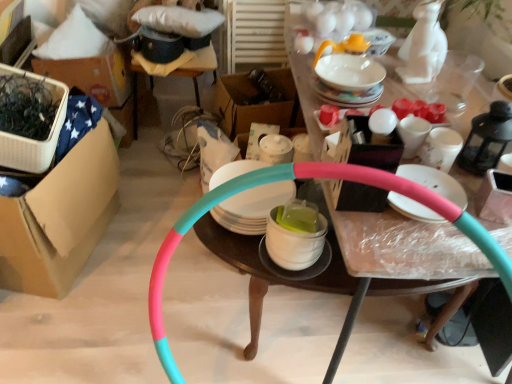
Where is `porcelain bowl at upper center, which is the 2th tableware from top to bottom`? The image size is (512, 384). porcelain bowl at upper center, which is the 2th tableware from top to bottom is located at coordinates (349, 72).

In order to face white glossy mug at upper right, which appears as the sixth tableware when ordered from the bottom, should I rotate leftwards or rightwards?

Rotate your view right by about 20.893°.

The width and height of the screenshot is (512, 384). What do you see at coordinates (435, 182) in the screenshot?
I see `matte white plate at center, which ranks as the third tableware in bottom-to-top order` at bounding box center [435, 182].

The height and width of the screenshot is (384, 512). Describe the element at coordinates (198, 68) in the screenshot. I see `wooden stool at upper left, arranged as the 1th table when viewed from the back` at that location.

This screenshot has width=512, height=384. What are the coordinates of `porcelain bowl at upper center, which is the 2th tableware from top to bottom` in the screenshot? It's located at (349, 72).

From the image's perspective, is wooden stool at upper left, arranged as the 1th table when viewed from the back, positioned above or below white glossy mug at upper right, which appears as the sixth tableware when ordered from the bottom?

Clearly, from the image's perspective, wooden stool at upper left, arranged as the 1th table when viewed from the back, is above white glossy mug at upper right, which appears as the sixth tableware when ordered from the bottom.

Between wooden stool at upper left, which is counted as the first table, starting from the top, and white glossy mug at upper right, placed as the third tableware when sorted from top to bottom, which one has larger size?

With larger size is wooden stool at upper left, which is counted as the first table, starting from the top.

Locate an element on the screen. The height and width of the screenshot is (384, 512). the 1st table located beneath the white glossy mug at upper right, which appears as the sixth tableware when ordered from the bottom (from a real-world perspective) is located at coordinates (198, 68).

From their relative heights in the image, would you say wooden stool at upper left, the 2th table positioned from the right, is taller or shorter than white glossy mug at upper right, placed as the third tableware when sorted from top to bottom?

In the image, wooden stool at upper left, the 2th table positioned from the right, appears to be taller than white glossy mug at upper right, placed as the third tableware when sorted from top to bottom.

How different are the orientations of porcelain teapot at upper right, which ranks as the 8th tableware in bottom-to-top order, and brown cardboard box at left in degrees?

porcelain teapot at upper right, which ranks as the 8th tableware in bottom-to-top order, and brown cardboard box at left are facing 105 degrees away from each other.

From the picture: Is porcelain teapot at upper right, which ranks as the 8th tableware in bottom-to-top order, positioned far away from brown cardboard box at left?

Absolutely, porcelain teapot at upper right, which ranks as the 8th tableware in bottom-to-top order, is distant from brown cardboard box at left.

Locate an element on the screen. The image size is (512, 384). tableware that is the 5th one when counting upward from the brown cardboard box at left (from the image's perspective) is located at coordinates (344, 46).

Considering the sizes of porcelain teapot at upper right, the first tableware viewed from the top, and brown cardboard box at left in the image, is porcelain teapot at upper right, the first tableware viewed from the top, taller or shorter than brown cardboard box at left?

In the image, porcelain teapot at upper right, the first tableware viewed from the top, appears to be shorter than brown cardboard box at left.

Which of these two, brown cardboard box at left or matte white plate at center, arranged as the sixth tableware when viewed from the top, stands shorter?

matte white plate at center, arranged as the sixth tableware when viewed from the top.

From a real-world perspective, which object stands above the other?

In real-world perspective, matte white plate at center, which ranks as the third tableware in bottom-to-top order, is above.

Considering the positions of point (89, 221) and point (435, 178), is point (89, 221) closer or farther from the camera than point (435, 178)?

Point (89, 221) appears to be farther away from the viewer than point (435, 178).

Looking at this image, can you confirm if wooden stool at upper left, positioned as the second table in bottom-to-top order, is thinner than matte white plate at center, arranged as the sixth tableware when viewed from the top?

No.

From a real-world perspective, is wooden stool at upper left, acting as the 2th table starting from the front, located higher than matte white plate at center, which ranks as the third tableware in bottom-to-top order?

No, from a real-world perspective, wooden stool at upper left, acting as the 2th table starting from the front, is not on top of matte white plate at center, which ranks as the third tableware in bottom-to-top order.

Considering the positions of objects wooden stool at upper left, which is counted as the first table, starting from the top, and matte white plate at center, arranged as the sixth tableware when viewed from the top, in the image provided, who is more to the left, wooden stool at upper left, which is counted as the first table, starting from the top, or matte white plate at center, arranged as the sixth tableware when viewed from the top,?

From the viewer's perspective, wooden stool at upper left, which is counted as the first table, starting from the top, appears more on the left side.

Is point (273, 243) farther from camera compared to point (307, 176)?

Yes.

Based on the photo, considering the relative positions of white glossy bowl at center, the 8th tableware viewed from the top, and teal-pink plastic hoop at center, which ranks as the second table in back-to-front order, in the image provided, is white glossy bowl at center, the 8th tableware viewed from the top, to the left of teal-pink plastic hoop at center, which ranks as the second table in back-to-front order, from the viewer's perspective?

Yes.

Between white glossy bowl at center, acting as the first tableware starting from the bottom, and teal-pink plastic hoop at center, which is the 1th table from bottom to top, which one has more height?

Standing taller between the two is teal-pink plastic hoop at center, which is the 1th table from bottom to top.

Are white glossy bowl at center, acting as the first tableware starting from the bottom, and teal-pink plastic hoop at center, which ranks as the second table in back-to-front order, beside each other?

No, white glossy bowl at center, acting as the first tableware starting from the bottom, is not next to teal-pink plastic hoop at center, which ranks as the second table in back-to-front order.

Between porcelain teapot at upper right, which ranks as the 8th tableware in bottom-to-top order, and teal-pink plastic hoop at center, which is the 1th table in right-to-left order, which one appears on the right side from the viewer's perspective?

teal-pink plastic hoop at center, which is the 1th table in right-to-left order.

Which is more distant, (321, 47) or (194, 222)?

The point (321, 47) is farther.

In the scene shown: Can you confirm if white glossy mug at upper right, which appears as the sixth tableware when ordered from the bottom, is positioned to the right of wooden stool at upper left, the 2th table positioned from the right?

Correct, you'll find white glossy mug at upper right, which appears as the sixth tableware when ordered from the bottom, to the right of wooden stool at upper left, the 2th table positioned from the right.

Which is farther, (421, 143) or (189, 60)?

The point (189, 60) is farther.

Is white glossy mug at upper right, placed as the third tableware when sorted from top to bottom, directly adjacent to wooden stool at upper left, which is the first table in left-to-right order?

No, white glossy mug at upper right, placed as the third tableware when sorted from top to bottom, is not next to wooden stool at upper left, which is the first table in left-to-right order.

From the image's perspective, is white glossy mug at upper right, placed as the third tableware when sorted from top to bottom, on wooden stool at upper left, the 2th table positioned from the right?

No.

The width and height of the screenshot is (512, 384). What are the coordinates of `table that appears behind the white glossy mug at upper right, which appears as the sixth tableware when ordered from the bottom` in the screenshot? It's located at (198, 68).

Locate an element on the screen. cardboard box below the porcelain teapot at upper right, the first tableware viewed from the top (from the image's perspective) is located at coordinates (60, 218).

Looking at this image, when comparing their distances from matte white plate at center, arranged as the sixth tableware when viewed from the top, does porcelain teapot at upper right, which ranks as the 8th tableware in bottom-to-top order, or brown cardboard box at left seem further?

brown cardboard box at left lies further to matte white plate at center, arranged as the sixth tableware when viewed from the top, than the other object.

Looking at the image, which one is located closer to matte white plate at center, arranged as the sixth tableware when viewed from the top, white glossy mug at center, which appears as the 4th tableware when viewed from the top, or porcelain bowl at upper center, which is the 2th tableware from top to bottom?

Among the two, white glossy mug at center, which appears as the 4th tableware when viewed from the top, is located nearer to matte white plate at center, arranged as the sixth tableware when viewed from the top.

Estimate the real-world distances between objects in this image. Which object is closer to white glossy mug at upper right, arranged as the 4th tableware when ordered from the bottom, white glossy plate at center, the 7th tableware when ordered from top to bottom, or white glossy bowl at center, acting as the first tableware starting from the bottom?

white glossy bowl at center, acting as the first tableware starting from the bottom, is positioned closer to the anchor white glossy mug at upper right, arranged as the 4th tableware when ordered from the bottom.

Estimate the real-world distances between objects in this image. Which object is further from porcelain teapot at upper right, the first tableware viewed from the top, teal-pink plastic hoop at center, which is the 1th table in right-to-left order, or matte white plate at center, which ranks as the third tableware in bottom-to-top order?

teal-pink plastic hoop at center, which is the 1th table in right-to-left order, lies further to porcelain teapot at upper right, the first tableware viewed from the top, than the other object.

Considering their positions, is porcelain teapot at upper right, the first tableware viewed from the top, positioned further to brown cardboard box at left than white glossy bowl at center, acting as the first tableware starting from the bottom?

porcelain teapot at upper right, the first tableware viewed from the top, is further to brown cardboard box at left.

Considering their positions, is porcelain bowl at upper center, which is the 2th tableware from top to bottom, positioned further to white glossy plate at center, the 7th tableware when ordered from top to bottom, than teal-pink plastic hoop at center, the 2th table positioned from the top?

porcelain bowl at upper center, which is the 2th tableware from top to bottom, lies further to white glossy plate at center, the 7th tableware when ordered from top to bottom, than the other object.

Based on their spatial positions, is white glossy bowl at center, acting as the first tableware starting from the bottom, or white glossy mug at upper right, the fifth tableware positioned from the top, further from matte white plate at center, arranged as the sixth tableware when viewed from the top?

white glossy bowl at center, acting as the first tableware starting from the bottom, is further to matte white plate at center, arranged as the sixth tableware when viewed from the top.

In the scene shown: Which object lies nearer to the anchor point white glossy mug at upper right, placed as the third tableware when sorted from top to bottom, wooden stool at upper left, positioned as the second table in bottom-to-top order, or porcelain bowl at upper center, which is the 2th tableware from top to bottom?

porcelain bowl at upper center, which is the 2th tableware from top to bottom, is closer to white glossy mug at upper right, placed as the third tableware when sorted from top to bottom.

What are the coordinates of `table between white glossy plate at center, acting as the 2th tableware starting from the bottom, and white glossy mug at upper right, which appears as the sixth tableware when ordered from the bottom, from left to right` in the screenshot? It's located at (307, 178).

Identify the location of table between brown cardboard box at left and white glossy mug at center, which appears as the 4th tableware when viewed from the top, from left to right. (198, 68).

Where is `table between brown cardboard box at left and teal-pink plastic hoop at center, the 2th table positioned from the top, from left to right`? table between brown cardboard box at left and teal-pink plastic hoop at center, the 2th table positioned from the top, from left to right is located at coordinates (198, 68).

Image resolution: width=512 pixels, height=384 pixels. Identify the location of table between white glossy plate at center, acting as the 2th tableware starting from the bottom, and white glossy mug at upper right, the fifth tableware positioned from the top, in the horizontal direction. (307, 178).